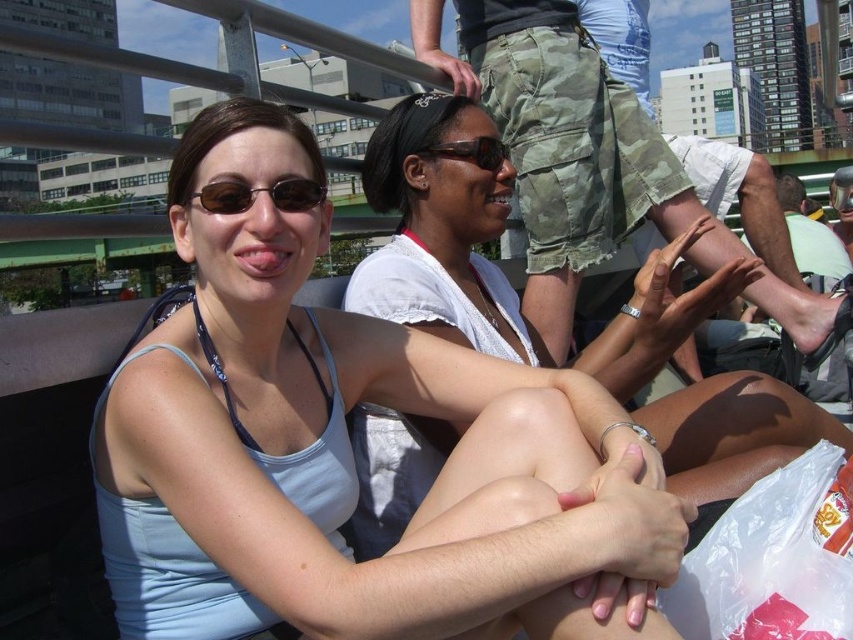
You are a photographer trying to capture a closeup shot of the sunglasses at center. The light blue fabric tank top at center is blocking your view. Can you estimate whether the tank top is wider than the sunglasses to determine if moving the camera slightly to the side might help?

The light blue fabric tank top at center is wider than the sunglasses at center, so moving the camera slightly to the side might help to avoid the obstruction caused by the tank top.

You are taking a photo of two women on a boat. You want to focus on the woman closer to the camera. Which point should you focus on, point [331,618] or point [448,150]?

Point [331,618] is closer to the viewer than point [448,150], so you should focus on point [331,618].

You are a photographer trying to capture a closeup of the light blue fabric tank top at center and the sunglasses at center. Since you want both items to appear clearly in the photo, which one should you focus on to ensure the larger object is in sharp focus?

The light blue fabric tank top at center is bigger than the sunglasses at center, so you should focus on the light blue fabric tank top at center to ensure it is in sharp focus.